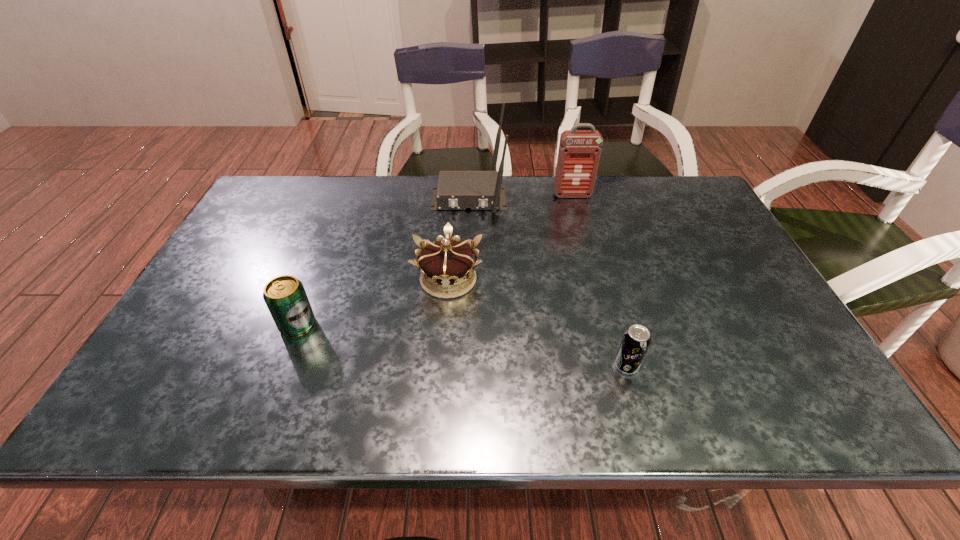
You are a GUI agent. You are given a task and a screenshot of the screen. Output one action in this format:
    pyautogui.click(x=<x>, y=<y>)
    Task: Click on the router
    The image size is (960, 540).
    Given the screenshot: What is the action you would take?
    click(457, 190)

The width and height of the screenshot is (960, 540). Find the location of `the first-aid kit`. the first-aid kit is located at coordinates (579, 152).

You are a GUI agent. You are given a task and a screenshot of the screen. Output one action in this format:
    pyautogui.click(x=<x>, y=<y>)
    Task: Click on the third farthest object
    The image size is (960, 540).
    Given the screenshot: What is the action you would take?
    pyautogui.click(x=445, y=262)

This screenshot has width=960, height=540. What are the coordinates of `beer can` in the screenshot? It's located at (285, 296).

Where is `the fourth farthest object`? the fourth farthest object is located at coordinates (285, 296).

The image size is (960, 540). Find the location of `soda can`. soda can is located at coordinates (636, 340).

At what (x,y) coordinates should I click in order to perform the action: click on free space located 0.280m on the back of the router to connect cables. Please return your answer as a coordinate pair (x, y). This screenshot has width=960, height=540. Looking at the image, I should click on (466, 285).

This screenshot has width=960, height=540. Identify the location of vacant point located on the front-facing side of the first-aid kit. pyautogui.click(x=592, y=269).

Identify the location of free spot located 0.230m on the left of the third nearest object. This screenshot has width=960, height=540. (325, 279).

Identify the location of free spot located 0.160m on the right of the second nearest object. (383, 325).